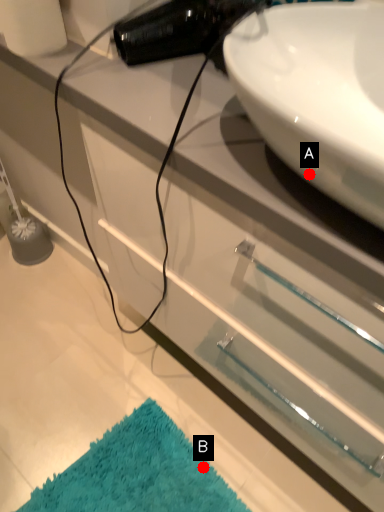
Question: Two points are circled on the image, labeled by A and B beside each circle. Which point is closer to the camera?

Choices:
 (A) A is closer
 (B) B is closer

Answer: (A)